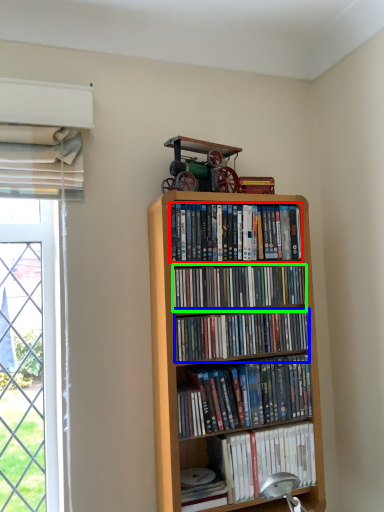
Question: Which is nearer to the book (highlighted by a red box)? book (highlighted by a blue box) or book (highlighted by a green box).

Choices:
 (A) book
 (B) book

Answer: (B)